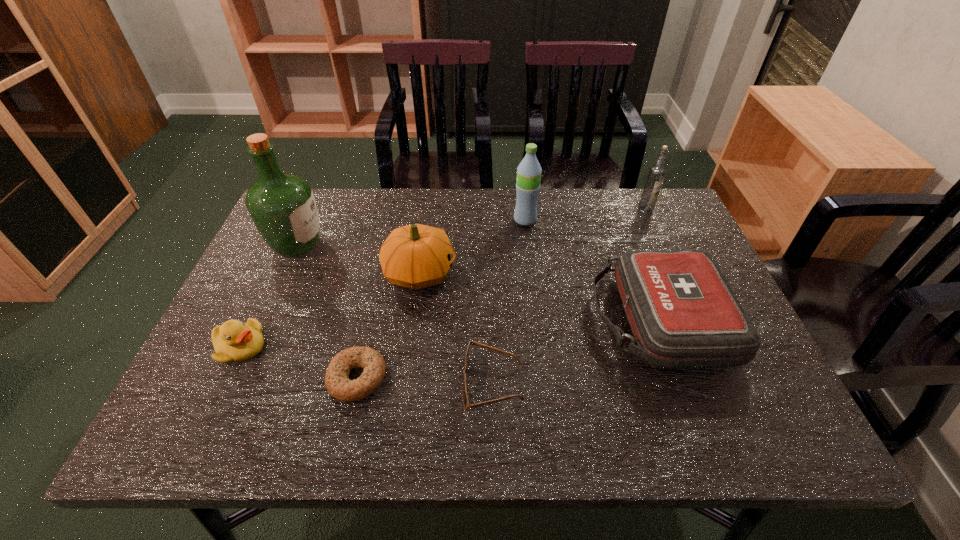
Image resolution: width=960 pixels, height=540 pixels. In order to click on unoccupied area between the fifth object from left to right and the fifth tallest object in this screenshot , I will do `click(575, 352)`.

You are a GUI agent. You are given a task and a screenshot of the screen. Output one action in this format:
    pyautogui.click(x=<x>, y=<y>)
    Task: Click on the empty space between the tallest object and the fourth tallest object
    The image size is (960, 540).
    Given the screenshot: What is the action you would take?
    pyautogui.click(x=358, y=259)

Where is `unoccupied position between the shortest object and the vodka`? unoccupied position between the shortest object and the vodka is located at coordinates (501, 293).

What are the coordinates of `the fifth closest object to the third shortest object` in the screenshot? It's located at (529, 170).

Locate which object ranks second in proximity to the shortest object. Please provide its 2D coordinates. Your answer should be formatted as a tuple, i.e. [(x, y)], where the tuple contains the x and y coordinates of a point satisfying the conditions above.

[(233, 341)]

Locate an element on the screen. This screenshot has width=960, height=540. vacant region that satisfies the following two spatial constraints: 1. on the label of the vodka; 2. on the front-facing side of the duckling is located at coordinates click(x=707, y=347).

You are a GUI agent. You are given a task and a screenshot of the screen. Output one action in this format:
    pyautogui.click(x=<x>, y=<y>)
    Task: Click on the vacant region that satisfies the following two spatial constraints: 1. on the label of the vodka; 2. on the front-facing side of the duckling
    The height and width of the screenshot is (540, 960).
    Given the screenshot: What is the action you would take?
    pyautogui.click(x=707, y=347)

Find the location of `free space in the image that satisfies the following two spatial constraints: 1. on the label of the vodka; 2. on the side of the fourth tallest object with the carved face`. free space in the image that satisfies the following two spatial constraints: 1. on the label of the vodka; 2. on the side of the fourth tallest object with the carved face is located at coordinates (674, 273).

What are the coordinates of `free location that satisfies the following two spatial constraints: 1. on the label of the vodka; 2. on the front-facing side of the tallest object` in the screenshot? It's located at (661, 245).